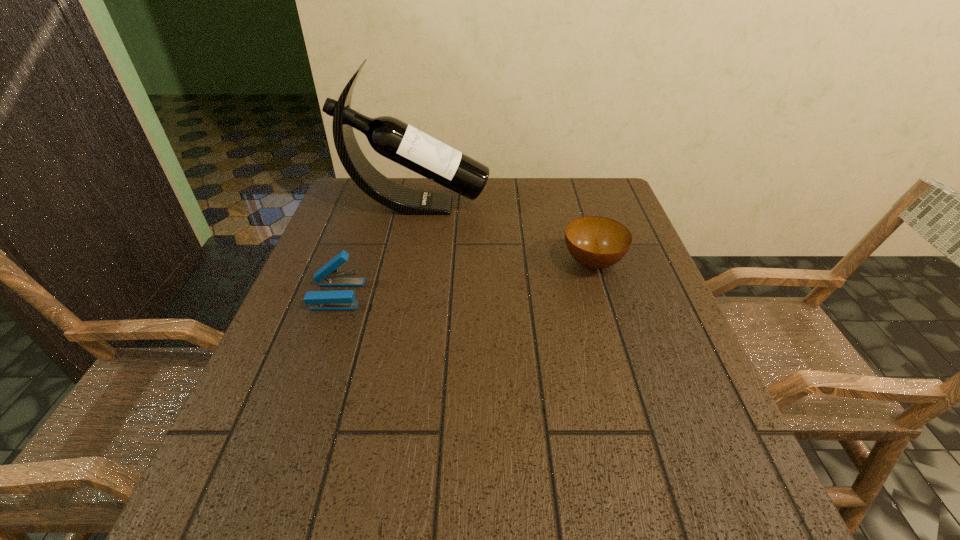
Identify the location of the farthest object. The image size is (960, 540). (390, 137).

This screenshot has height=540, width=960. What are the coordinates of `wine bottle` in the screenshot? It's located at (390, 137).

I want to click on stapler, so click(327, 276).

This screenshot has height=540, width=960. What are the coordinates of `the rightmost object` in the screenshot? It's located at (596, 242).

Locate an element on the screen. vacant area situated on the stand of the farthest object is located at coordinates (564, 206).

Where is `free space located 0.130m on the right of the stapler`? free space located 0.130m on the right of the stapler is located at coordinates (420, 295).

The width and height of the screenshot is (960, 540). Identify the location of vacant space located 0.300m on the back of the rightmost object. (568, 185).

Identify the location of object that is at the far edge. Image resolution: width=960 pixels, height=540 pixels. (390, 137).

Image resolution: width=960 pixels, height=540 pixels. I want to click on wine bottle that is at the left edge, so click(x=390, y=137).

Where is `stapler present at the left edge`? This screenshot has height=540, width=960. stapler present at the left edge is located at coordinates (327, 276).